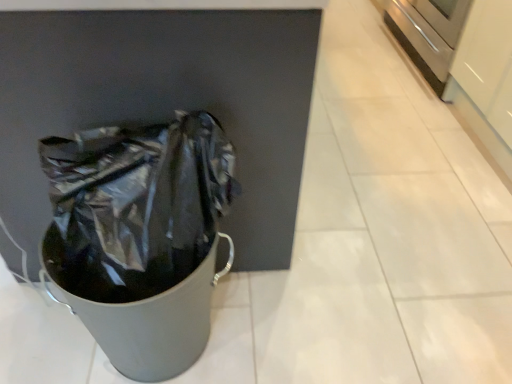
Question: Should I look upward or downward to see satin stainless steel oven at right?

Choices:
 (A) down
 (B) up

Answer: (B)